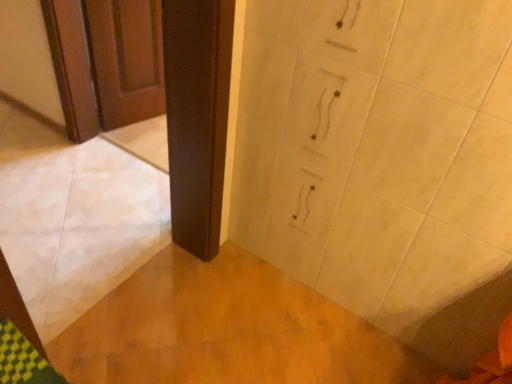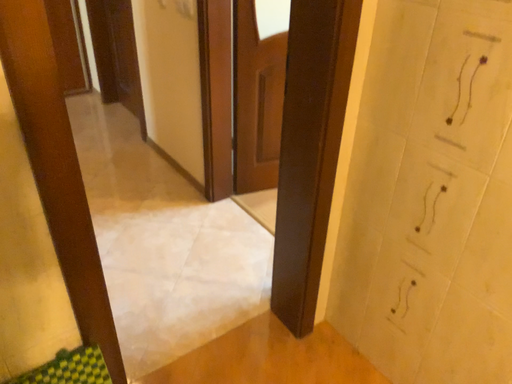
Question: How did the camera likely rotate when shooting the video?

Choices:
 (A) rotated downward
 (B) rotated upward

Answer: (B)